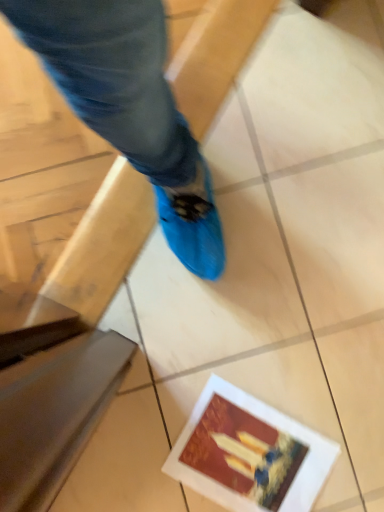
Question: From a real-world perspective, is smooth beige tile at lower left positioned above or below matte paper postcard at lower right?

Choices:
 (A) below
 (B) above

Answer: (B)

Question: In terms of width, does smooth beige tile at lower left look wider or thinner when compared to matte paper postcard at lower right?

Choices:
 (A) wide
 (B) thin

Answer: (B)

Question: In the image, is smooth beige tile at lower left positioned in front of or behind matte paper postcard at lower right?

Choices:
 (A) behind
 (B) front

Answer: (B)

Question: In the image, is matte paper postcard at lower right positioned in front of or behind smooth beige tile at lower left?

Choices:
 (A) front
 (B) behind

Answer: (B)

Question: From a real-world perspective, is matte paper postcard at lower right positioned above or below smooth beige tile at lower left?

Choices:
 (A) below
 (B) above

Answer: (A)

Question: Do you think matte paper postcard at lower right is within smooth beige tile at lower left, or outside of it?

Choices:
 (A) inside
 (B) outside

Answer: (B)

Question: Considering the relative positions of matte paper postcard at lower right and smooth beige tile at lower left in the image provided, is matte paper postcard at lower right to the left or to the right of smooth beige tile at lower left?

Choices:
 (A) left
 (B) right

Answer: (B)